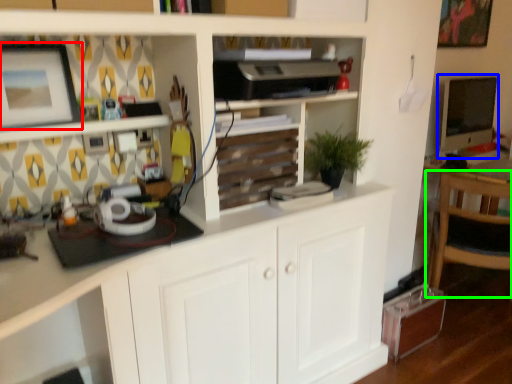
Question: Considering the real-world distances, which object is closest to picture frame (highlighted by a red box)? computer monitor (highlighted by a blue box) or chair (highlighted by a green box).

Choices:
 (A) computer monitor
 (B) chair

Answer: (B)